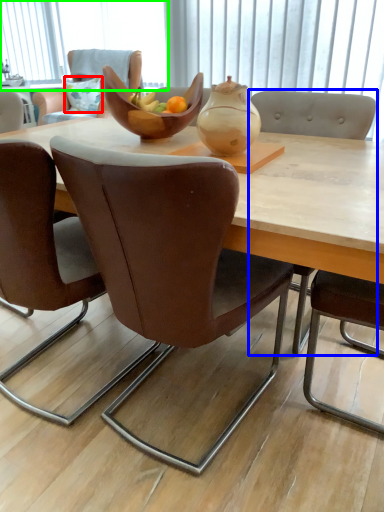
Question: Considering the real-world distances, which object is farthest from pillow (highlighted by a red box)? chair (highlighted by a blue box) or window screen (highlighted by a green box)?

Choices:
 (A) chair
 (B) window screen

Answer: (A)